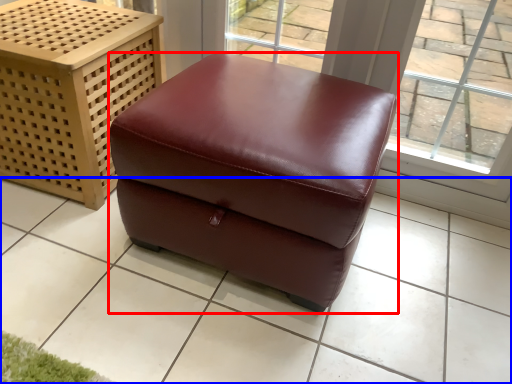
Question: Which object is closer to the camera taking this photo, furniture (highlighted by a red box) or tile (highlighted by a blue box)?

Choices:
 (A) furniture
 (B) tile

Answer: (B)